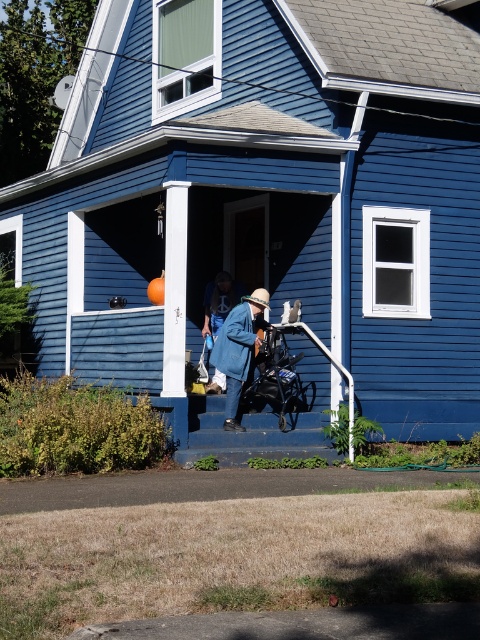
Question: Which point appears farthest from the camera in this image?

Choices:
 (A) (220, 330)
 (B) (274, 326)
 (C) (212, 301)

Answer: (C)

Question: Does black fabric baby carriage at center have a greater width compared to blue denim jacket at center?

Choices:
 (A) no
 (B) yes

Answer: (B)

Question: Among these objects, which one is farthest from the camera?

Choices:
 (A) black fabric baby carriage at center
 (B) blue denim jacket at center
 (C) blue fuzzy coat at center

Answer: (C)

Question: Does blue denim jacket at center have a larger size compared to blue fuzzy coat at center?

Choices:
 (A) no
 (B) yes

Answer: (B)

Question: Which point is closer to the camera?

Choices:
 (A) (235, 371)
 (B) (218, 296)
 (C) (276, 333)

Answer: (A)

Question: Can you confirm if black fabric baby carriage at center is positioned to the left of blue denim jacket at center?

Choices:
 (A) no
 (B) yes

Answer: (A)